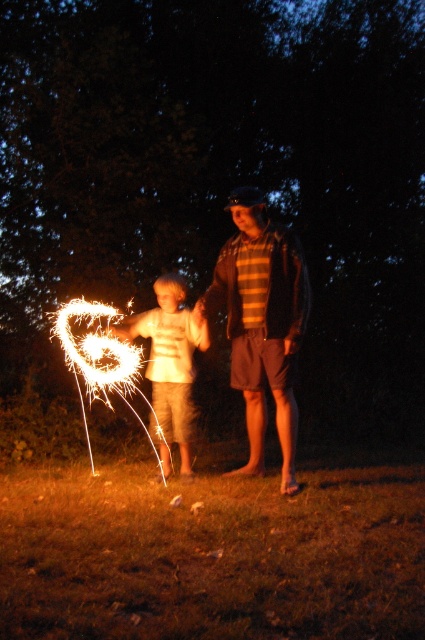
Which is below, striped cotton shirt at center or white cotton shirt at center?

white cotton shirt at center

Is striped cotton shirt at center taller than white cotton shirt at center?

Indeed, striped cotton shirt at center has a greater height compared to white cotton shirt at center.

Who is more forward, [257,211] or [170,440]?

Positioned in front is point [257,211].

Locate an element on the screen. striped cotton shirt at center is located at coordinates (260, 323).